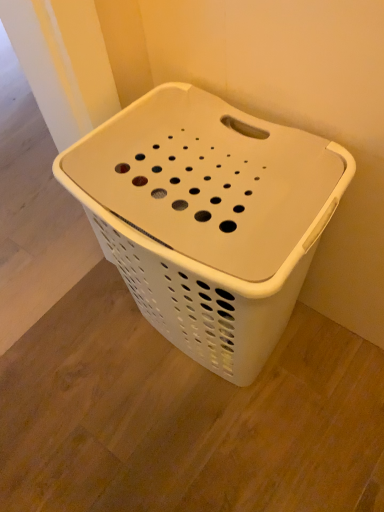
At what (x,y) coordinates should I click in order to perform the action: click on free space on the front side of white plastic laundry basket at center. Please return your answer as a coordinate pair (x, y). Looking at the image, I should click on (233, 445).